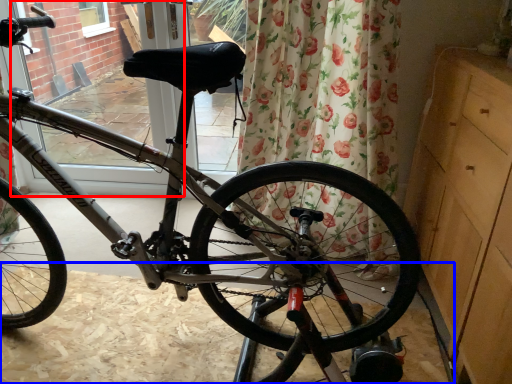
Question: Which object is closer to the camera taking this photo, screen door (highlighted by a red box) or dirt track (highlighted by a blue box)?

Choices:
 (A) screen door
 (B) dirt track

Answer: (B)